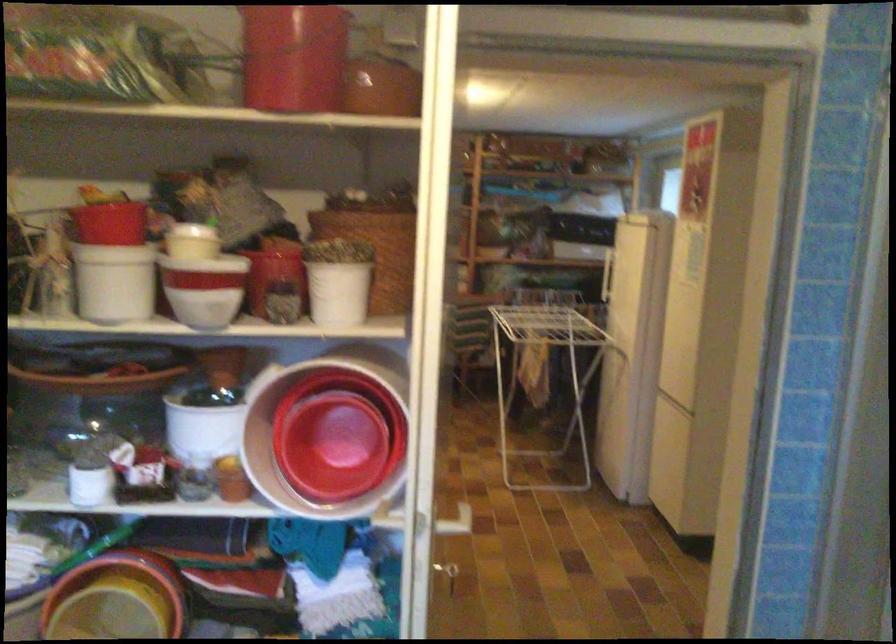
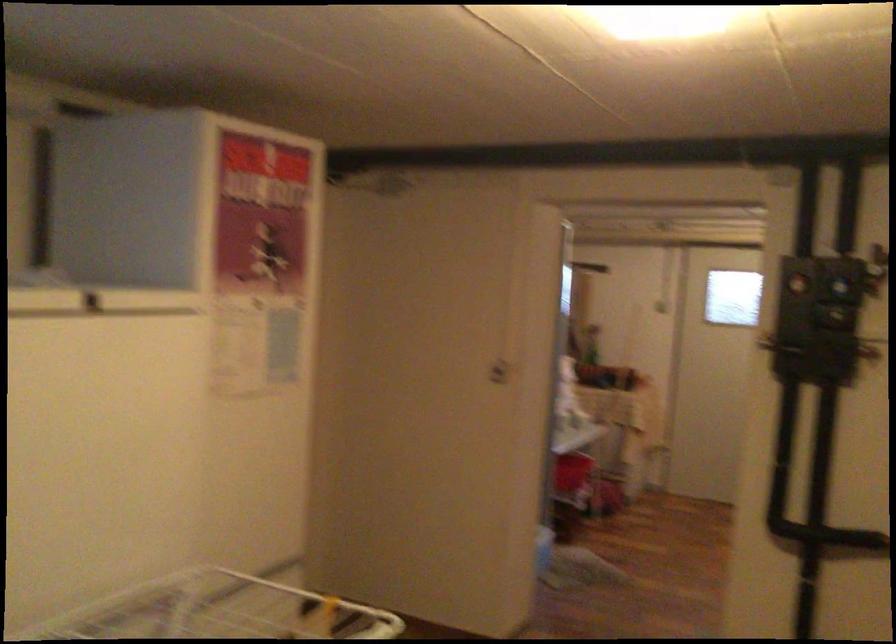
Question: I am providing you with two images of the same scene from different viewpoints. After the viewpoint changes to image2, which objects are now occluded?

Choices:
 (A) blue control dial
 (B) refrigerator door handle
 (C) red plastic bowl
 (D) small gray canister

Answer: (C)